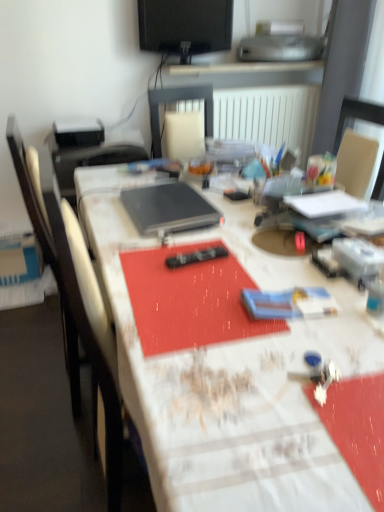
Where is `vacant area that lies in front of black matte laptop at center`? Image resolution: width=384 pixels, height=512 pixels. vacant area that lies in front of black matte laptop at center is located at coordinates (172, 251).